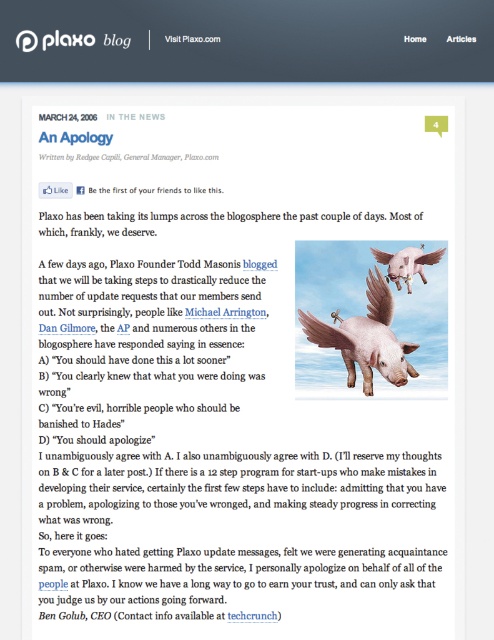
Is matte pink pig at center further to camera compared to pink feathered pig at upper right?

No.

Can you confirm if matte pink pig at center is bigger than pink feathered pig at upper right?

Yes.

Where is `matte pink pig at center`? Image resolution: width=494 pixels, height=640 pixels. matte pink pig at center is located at coordinates (366, 337).

The height and width of the screenshot is (640, 494). I want to click on matte pink pig at center, so click(366, 337).

Who is lower down, matte pink pig at center or black text at bottom right?

black text at bottom right

Between matte pink pig at center and black text at bottom right, which one has more height?

matte pink pig at center is taller.

Is point (361, 364) farther from viewer compared to point (258, 616)?

Yes, it is.

The width and height of the screenshot is (494, 640). I want to click on matte pink pig at center, so click(x=366, y=337).

Can you confirm if pink feathered pig at upper right is shorter than black text at bottom right?

No.

Can you confirm if pink feathered pig at upper right is wider than black text at bottom right?

Indeed, pink feathered pig at upper right has a greater width compared to black text at bottom right.

Is point (433, 253) closer to viewer compared to point (232, 614)?

No, (433, 253) is behind (232, 614).

At what (x,y) coordinates should I click in order to perform the action: click on pink feathered pig at upper right. Please return your answer as a coordinate pair (x, y). The width and height of the screenshot is (494, 640). Looking at the image, I should click on (407, 262).